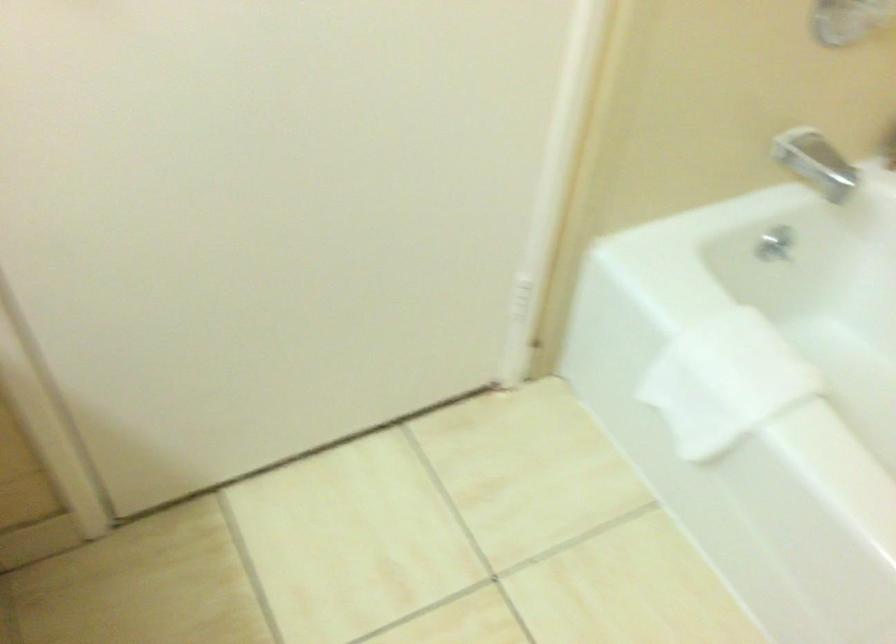
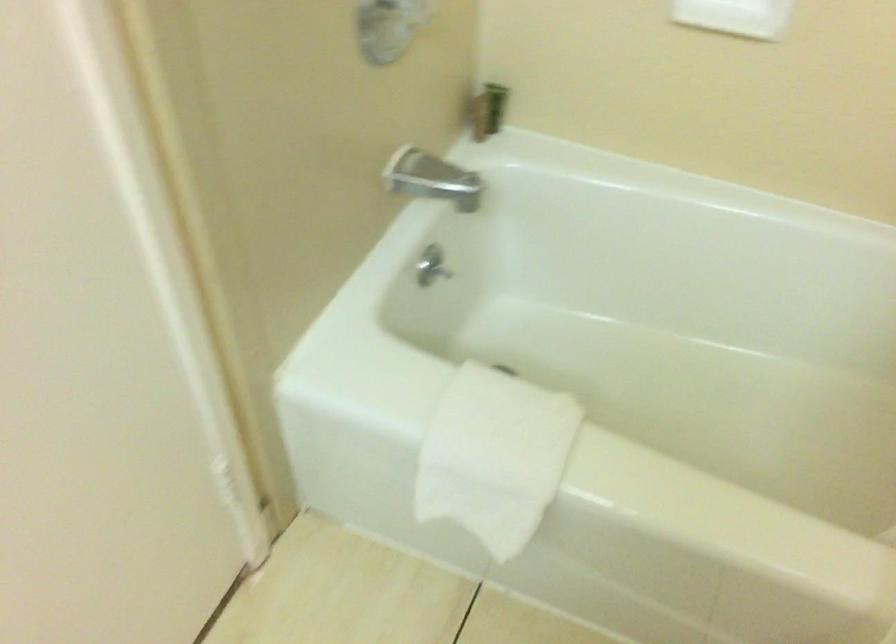
Where in the second image is the point corresponding to (774,240) from the first image?

(431, 266)